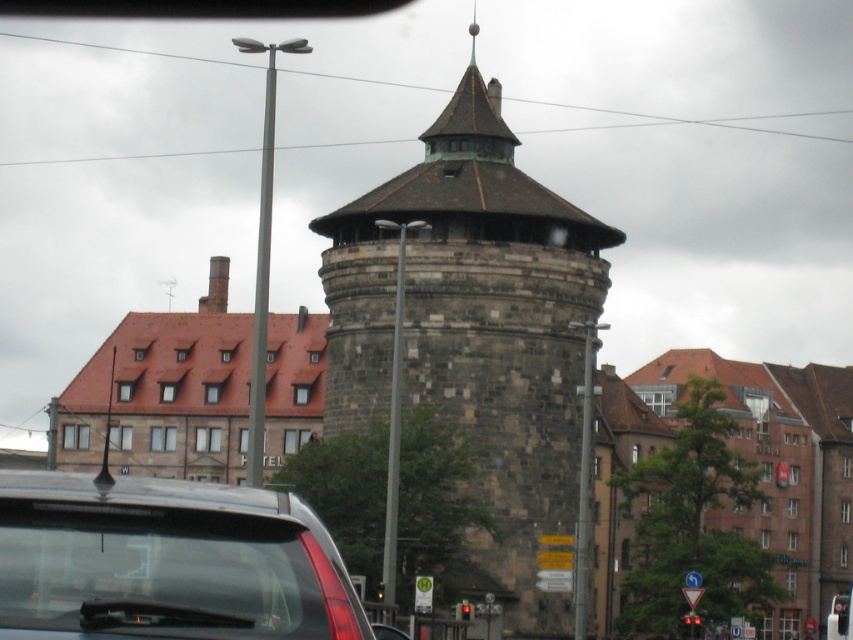
You are sitting in a car and looking out the window. You see two points marked on the road ahead. The first point is at coordinates point (531, 502) and the second is at point (196, 524). Which point is closer to your current position?

Point (196, 524) is closer to your current position because it is in front of point (531, 502), which is behind it.

You are driving a car and want to know if the brown stone tower at center is wider than the transparent glass car at lower left. Based on the scene, can you determine which one is wider?

The brown stone tower at center is wider than the transparent glass car at lower left according to the description.

You are a photographer standing next to the transparent glass car at lower left. You want to capture a photo of the brown stone tower at center. Considering the height difference between them, will the tower completely block the view of the car in your photo?

The brown stone tower at center is taller than the transparent glass car at lower left. Since the tower is taller, it may block part of the car in the photo depending on the angle and distance, but the entire car might still be visible if positioned correctly.